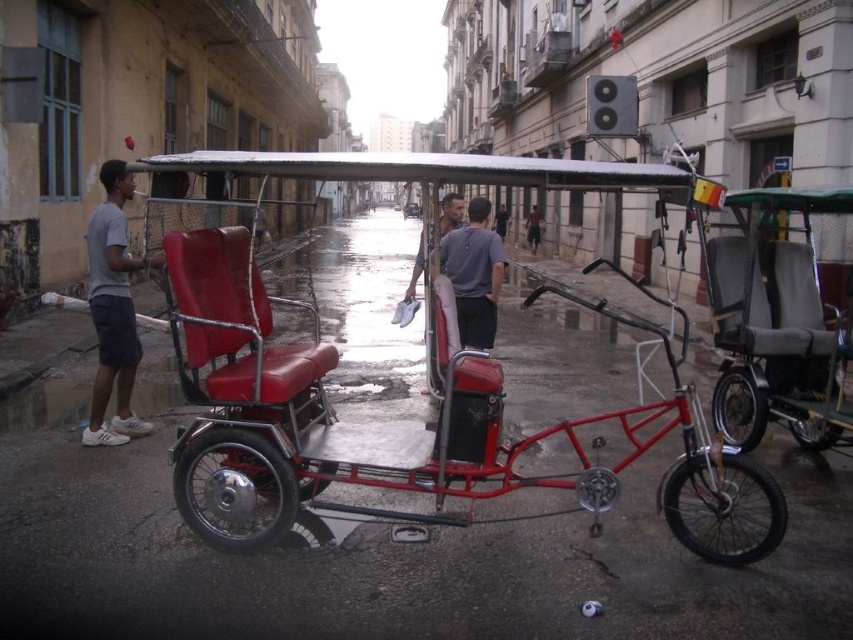
Question: Which point appears closest to the camera in this image?

Choices:
 (A) (526, 221)
 (B) (136, 426)
 (C) (189, 170)

Answer: (C)

Question: Can you confirm if metallic red tricycle at center is wider than skinny jeans at center?

Choices:
 (A) yes
 (B) no

Answer: (A)

Question: Among these points, which one is nearest to the camera?

Choices:
 (A) tap(473, 205)
 (B) tap(120, 257)
 (C) tap(813, 348)
 (D) tap(538, 227)

Answer: (B)

Question: Which point is closer to the camera?

Choices:
 (A) (286, 160)
 (B) (534, 220)
 (C) (463, 228)

Answer: (A)

Question: Can you confirm if metallic red tricycle at center is positioned below gray fabric shirt at center?

Choices:
 (A) no
 (B) yes

Answer: (B)

Question: Can you confirm if matte gray shirt at center is bigger than skinny jeans at center?

Choices:
 (A) no
 (B) yes

Answer: (A)